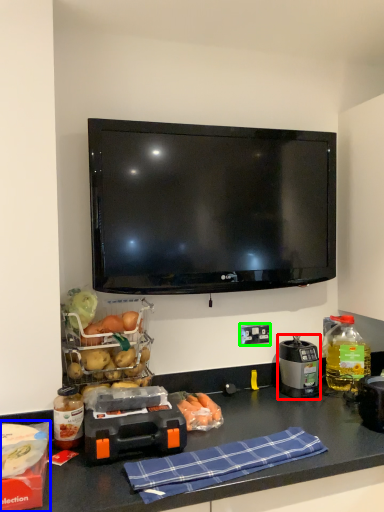
Question: Considering the real-world distances, which object is closest to kitchen appliance (highlighted by a red box)? box (highlighted by a blue box) or electric outlet (highlighted by a green box).

Choices:
 (A) box
 (B) electric outlet

Answer: (B)